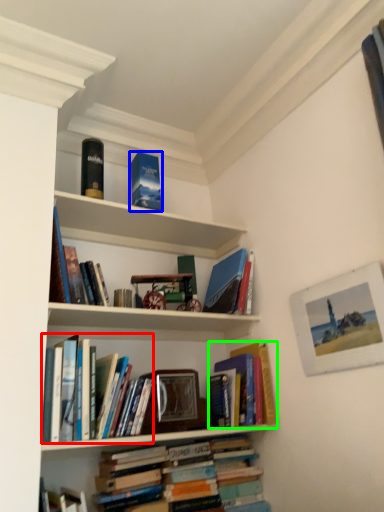
Question: Considering the real-world distances, which object is closest to book (highlighted by a red box)? paperback book (highlighted by a blue box) or book (highlighted by a green box).

Choices:
 (A) paperback book
 (B) book

Answer: (B)